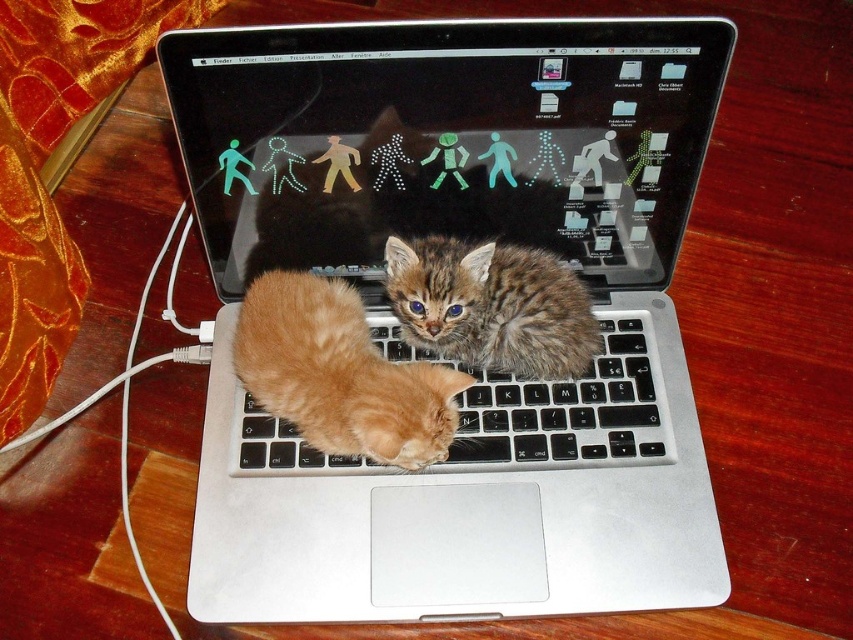
Describe the element at coordinates (430, 349) in the screenshot. This screenshot has width=853, height=640. I see `silver metallic laptop at center` at that location.

Who is more distant from viewer, [317,134] or [527,436]?

Point [527,436]

Describe the element at coordinates (430, 349) in the screenshot. I see `silver metallic laptop at center` at that location.

Locate an element on the screen. The width and height of the screenshot is (853, 640). silver metallic laptop at center is located at coordinates (430, 349).

Who is shorter, black plastic keyboard at center or fuzzy brown tabby at center?

fuzzy brown tabby at center

The width and height of the screenshot is (853, 640). Describe the element at coordinates (570, 410) in the screenshot. I see `black plastic keyboard at center` at that location.

Does point (540, 442) lie in front of point (444, 307)?

Yes.

Find the location of a particular element. black plastic keyboard at center is located at coordinates (570, 410).

Consider the image. Is the position of silver metallic laptop at center more distant than that of fuzzy brown tabby at center?

That is False.

In the scene shown: Is silver metallic laptop at center thinner than fuzzy brown tabby at center?

No.

The width and height of the screenshot is (853, 640). What are the coordinates of `silver metallic laptop at center` in the screenshot? It's located at (430, 349).

This screenshot has height=640, width=853. Identify the location of silver metallic laptop at center. (430, 349).